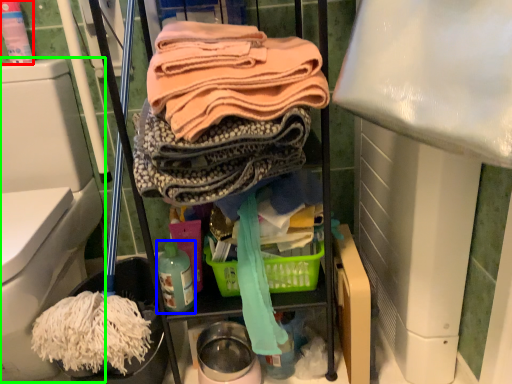
Question: Which object is the closest to the cleaning product (highlighted by a red box)? Choose among these: bottle (highlighted by a blue box) or bidet (highlighted by a green box).

Choices:
 (A) bottle
 (B) bidet

Answer: (B)